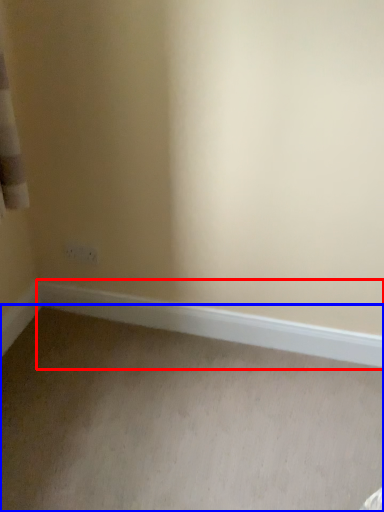
Question: Which point is closer to the camera, window sill (highlighted by a red box) or plain (highlighted by a blue box)?

Choices:
 (A) window sill
 (B) plain

Answer: (B)